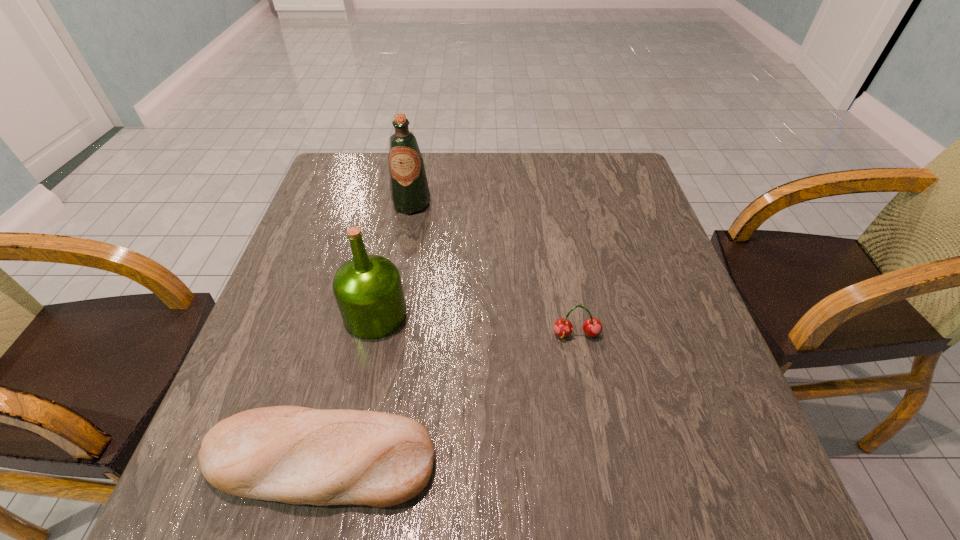
Locate an element on the screen. This screenshot has height=540, width=960. the farther olive oil is located at coordinates (409, 190).

The height and width of the screenshot is (540, 960). In order to click on the nearer olive oil in this screenshot , I will do `click(368, 290)`.

The image size is (960, 540). Find the location of `the rightmost object`. the rightmost object is located at coordinates (592, 327).

Find the location of a particular element. Image resolution: width=960 pixels, height=540 pixels. the nearest object is located at coordinates (298, 455).

Identify the location of free point located on the front-facing side of the farther olive oil. Image resolution: width=960 pixels, height=540 pixels. (394, 302).

Locate an element on the screen. free region located 0.340m on the back of the nearer olive oil is located at coordinates (399, 200).

Where is `vacant space situated with stems pointing upwards on the rightmost object`? vacant space situated with stems pointing upwards on the rightmost object is located at coordinates (601, 464).

This screenshot has height=540, width=960. Find the location of `free spot located 0.330m on the right of the nearest object`. free spot located 0.330m on the right of the nearest object is located at coordinates (637, 460).

You are a GUI agent. You are given a task and a screenshot of the screen. Output one action in this format:
    pyautogui.click(x=<x>, y=<y>)
    Task: Click on the object present at the far edge
    The image size is (960, 540).
    Given the screenshot: What is the action you would take?
    pyautogui.click(x=409, y=190)

You are a GUI agent. You are given a task and a screenshot of the screen. Output one action in this format:
    pyautogui.click(x=<x>, y=<y>)
    Task: Click on the object at the near edge
    The image size is (960, 540).
    Given the screenshot: What is the action you would take?
    pyautogui.click(x=298, y=455)